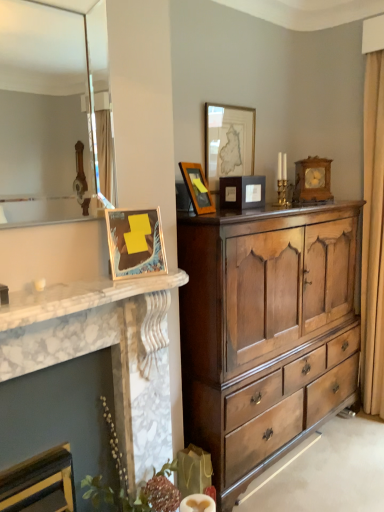
Question: Could you tell me if matte wooden picture frame at upper center, the second picture frame when ordered from back to front, is facing white marble fireplace at left?

Choices:
 (A) yes
 (B) no

Answer: (B)

Question: Can you confirm if matte wooden picture frame at upper center, the second picture frame when ordered from back to front, is shorter than white marble fireplace at left?

Choices:
 (A) yes
 (B) no

Answer: (B)

Question: Does matte wooden picture frame at upper center, which ranks as the 3th picture frame in right-to-left order, have a greater height compared to white marble fireplace at left?

Choices:
 (A) yes
 (B) no

Answer: (A)

Question: Does matte wooden picture frame at upper center, the second picture frame when ordered from back to front, appear on the right side of white marble fireplace at left?

Choices:
 (A) yes
 (B) no

Answer: (A)

Question: Considering the relative sizes of matte wooden picture frame at upper center, which ranks as the 3th picture frame in right-to-left order, and white marble fireplace at left in the image provided, is matte wooden picture frame at upper center, which ranks as the 3th picture frame in right-to-left order, wider than white marble fireplace at left?

Choices:
 (A) yes
 (B) no

Answer: (B)

Question: From the image's perspective, is matte wooden picture frame at upper center, the second picture frame when ordered from back to front, on top of white marble fireplace at left?

Choices:
 (A) yes
 (B) no

Answer: (A)

Question: Can you confirm if wooden clock at upper right, placed as the first picture frame when sorted from right to left, is smaller than white marble fireplace at left?

Choices:
 (A) yes
 (B) no

Answer: (A)

Question: Does wooden clock at upper right, arranged as the fifth picture frame when viewed from the left, have a lesser width compared to white marble fireplace at left?

Choices:
 (A) yes
 (B) no

Answer: (A)

Question: From the image's perspective, is wooden clock at upper right, arranged as the fifth picture frame when viewed from the left, under white marble fireplace at left?

Choices:
 (A) yes
 (B) no

Answer: (B)

Question: Would you consider wooden clock at upper right, placed as the 1th picture frame when sorted from back to front, to be distant from white marble fireplace at left?

Choices:
 (A) yes
 (B) no

Answer: (A)

Question: Is wooden clock at upper right, placed as the 1th picture frame when sorted from back to front, at the right side of white marble fireplace at left?

Choices:
 (A) no
 (B) yes

Answer: (B)

Question: Does wooden clock at upper right, arranged as the fifth picture frame when viewed from the left, turn towards white marble fireplace at left?

Choices:
 (A) no
 (B) yes

Answer: (A)

Question: Does wooden clock at upper right, placed as the first picture frame when sorted from right to left, appear on the left side of white marble fireplace at left?

Choices:
 (A) no
 (B) yes

Answer: (A)